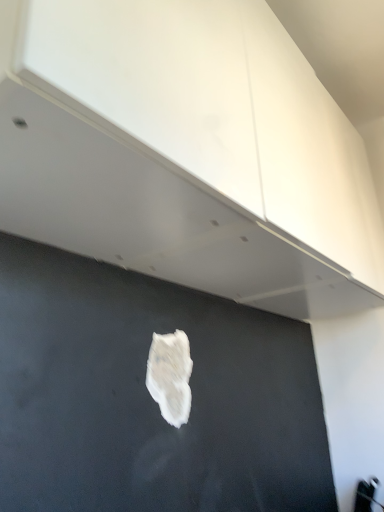
Question: From a real-world perspective, relative to white matte paper at center, is white glossy cabinet at upper center vertically above or below?

Choices:
 (A) above
 (B) below

Answer: (A)

Question: Is white glossy cabinet at upper center spatially inside white matte paper at center, or outside of it?

Choices:
 (A) inside
 (B) outside

Answer: (B)

Question: Is point (291, 189) closer or farther from the camera than point (160, 343)?

Choices:
 (A) closer
 (B) farther

Answer: (A)

Question: Would you say white matte paper at center is inside or outside white glossy cabinet at upper center?

Choices:
 (A) outside
 (B) inside

Answer: (A)

Question: From the image's perspective, is white matte paper at center above or below white glossy cabinet at upper center?

Choices:
 (A) below
 (B) above

Answer: (A)

Question: Based on their positions, is white matte paper at center located to the left or right of white glossy cabinet at upper center?

Choices:
 (A) right
 (B) left

Answer: (B)

Question: Considering their positions, is white matte paper at center located in front of or behind white glossy cabinet at upper center?

Choices:
 (A) behind
 (B) front

Answer: (A)